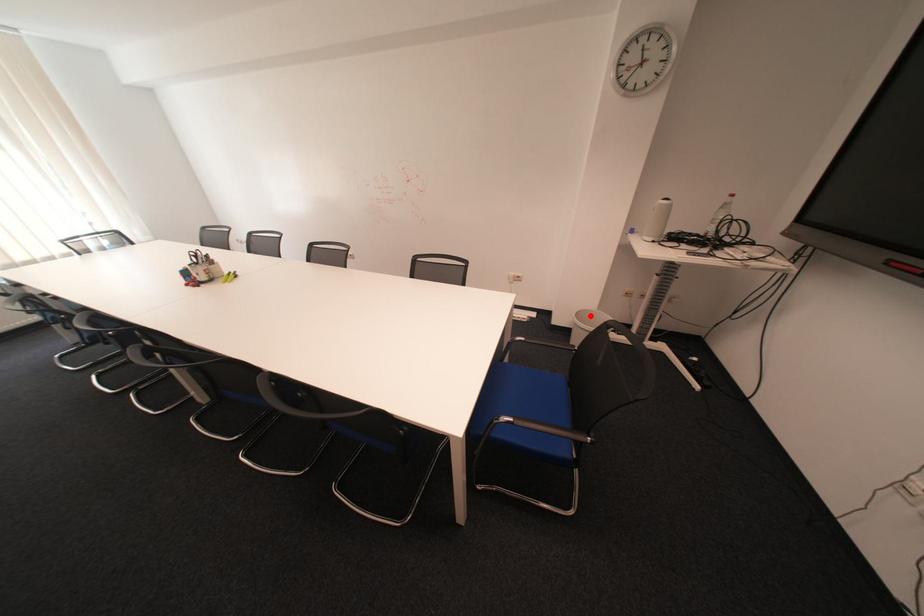
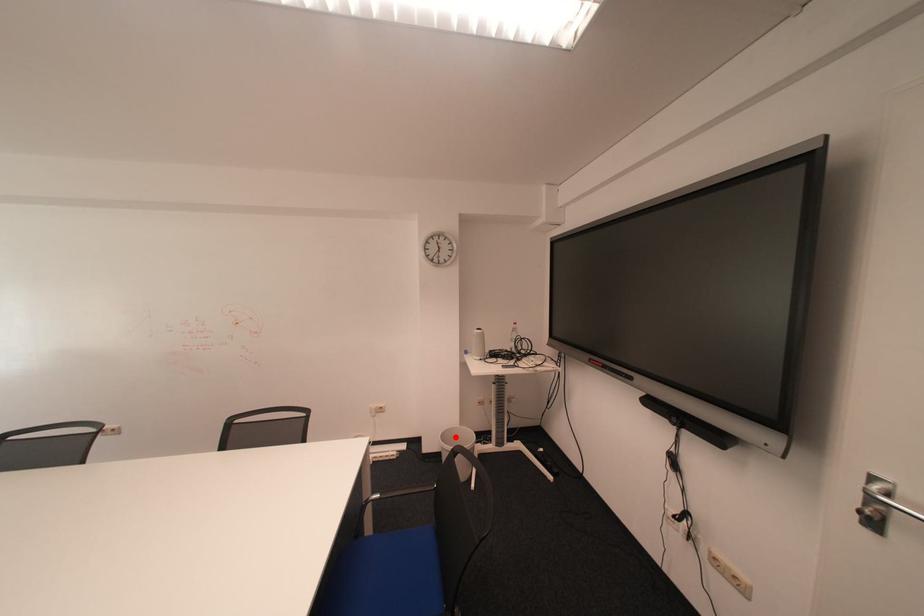
I am providing you with two images of the same scene from different viewpoints. A red point is marked on the first image and another point is marked on the second image. Do the highlighted points in image1 and image2 indicate the same real-world spot?

Yes